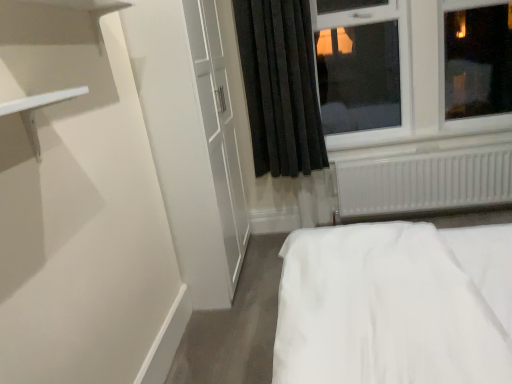
Question: Should I look upward or downward to see white plastic window at upper right?

Choices:
 (A) down
 (B) up

Answer: (B)

Question: Can you confirm if black velvet curtain at upper center is smaller than white plastic window at upper right?

Choices:
 (A) yes
 (B) no

Answer: (A)

Question: Does black velvet curtain at upper center have a greater height compared to white plastic window at upper right?

Choices:
 (A) no
 (B) yes

Answer: (B)

Question: Does black velvet curtain at upper center appear on the left side of white plastic window at upper right?

Choices:
 (A) no
 (B) yes

Answer: (B)

Question: Does black velvet curtain at upper center contain white plastic window at upper right?

Choices:
 (A) yes
 (B) no

Answer: (B)

Question: From a real-world perspective, is black velvet curtain at upper center physically below white plastic window at upper right?

Choices:
 (A) no
 (B) yes

Answer: (B)

Question: Can we say black velvet curtain at upper center lies outside white plastic window at upper right?

Choices:
 (A) yes
 (B) no

Answer: (A)

Question: Is white plastic window at upper right at the right side of white plastic radiator at lower right?

Choices:
 (A) no
 (B) yes

Answer: (A)

Question: Is white plastic window at upper right taller than white plastic radiator at lower right?

Choices:
 (A) yes
 (B) no

Answer: (A)

Question: Considering the relative sizes of white plastic window at upper right and white plastic radiator at lower right in the image provided, is white plastic window at upper right thinner than white plastic radiator at lower right?

Choices:
 (A) no
 (B) yes

Answer: (A)

Question: Is white plastic window at upper right shorter than white plastic radiator at lower right?

Choices:
 (A) no
 (B) yes

Answer: (A)

Question: Is the position of white plastic window at upper right less distant than that of white plastic radiator at lower right?

Choices:
 (A) yes
 (B) no

Answer: (A)

Question: From a real-world perspective, is white plastic window at upper right physically below white plastic radiator at lower right?

Choices:
 (A) yes
 (B) no

Answer: (B)

Question: From a real-world perspective, is black velvet curtain at upper center located beneath white plastic radiator at lower right?

Choices:
 (A) yes
 (B) no

Answer: (B)